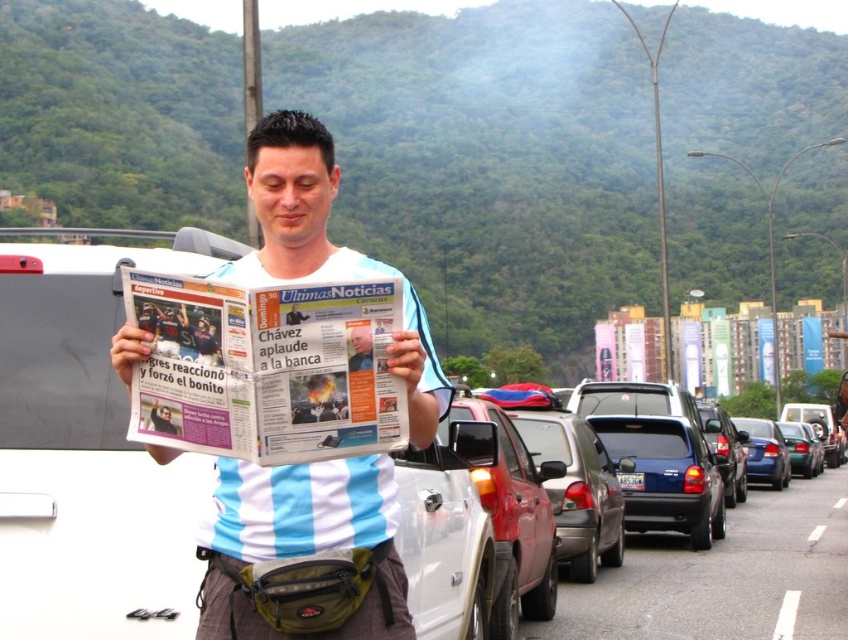
Who is more forward, (321, 500) or (785, 422)?

Point (321, 500) is in front.

Is point (294, 477) more distant than point (816, 444)?

That is False.

The width and height of the screenshot is (848, 640). What are the coordinates of `white cotton shirt at center` in the screenshot? It's located at (304, 548).

Does white cotton shirt at center appear over blue metallic sedan at center-right?

Correct, white cotton shirt at center is located above blue metallic sedan at center-right.

Describe the element at coordinates (304, 548) in the screenshot. This screenshot has width=848, height=640. I see `white cotton shirt at center` at that location.

Image resolution: width=848 pixels, height=640 pixels. Find the location of `white cotton shirt at center`. white cotton shirt at center is located at coordinates (304, 548).

Between shiny blue sedan at center-right and blue metallic sedan at center-right, which one has more height?

shiny blue sedan at center-right

Between point (643, 460) and point (750, 426), which one is positioned in front?

Point (643, 460) is in front.

Where is `shiny blue sedan at center-right`? This screenshot has width=848, height=640. shiny blue sedan at center-right is located at coordinates (667, 476).